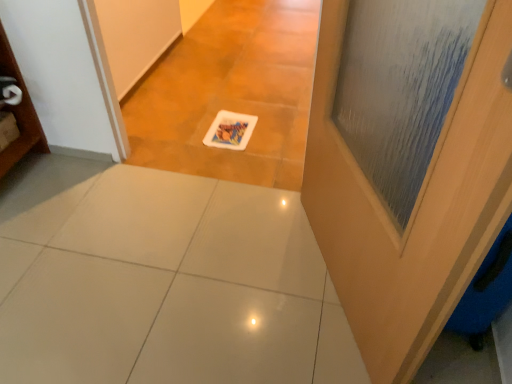
Question: Is white glossy tile at center further to camera compared to wooden door at right?

Choices:
 (A) no
 (B) yes

Answer: (B)

Question: Is white glossy tile at center positioned with its back to wooden door at right?

Choices:
 (A) no
 (B) yes

Answer: (A)

Question: Does white glossy tile at center have a greater height compared to wooden door at right?

Choices:
 (A) no
 (B) yes

Answer: (A)

Question: Considering the relative sizes of white glossy tile at center and wooden door at right in the image provided, is white glossy tile at center wider than wooden door at right?

Choices:
 (A) no
 (B) yes

Answer: (B)

Question: Is white glossy tile at center with wooden door at right?

Choices:
 (A) yes
 (B) no

Answer: (B)

Question: Considering the relative sizes of white glossy tile at center and wooden door at right in the image provided, is white glossy tile at center shorter than wooden door at right?

Choices:
 (A) no
 (B) yes

Answer: (B)

Question: From a real-world perspective, is wooden door at right under white glossy tile at center?

Choices:
 (A) yes
 (B) no

Answer: (B)

Question: From the image's perspective, is wooden door at right under white glossy tile at center?

Choices:
 (A) no
 (B) yes

Answer: (A)

Question: From the image's perspective, would you say wooden door at right is positioned over white glossy tile at center?

Choices:
 (A) no
 (B) yes

Answer: (B)

Question: Does wooden door at right have a greater height compared to white glossy tile at center?

Choices:
 (A) yes
 (B) no

Answer: (A)

Question: Does wooden door at right have a lesser width compared to white glossy tile at center?

Choices:
 (A) yes
 (B) no

Answer: (A)

Question: Is wooden door at right to the left of white glossy tile at center from the viewer's perspective?

Choices:
 (A) yes
 (B) no

Answer: (B)

Question: Is wooden door at right taller or shorter than white glossy tile at center?

Choices:
 (A) tall
 (B) short

Answer: (A)